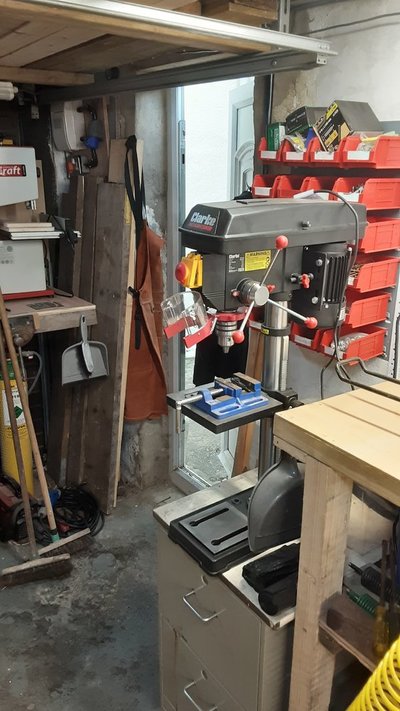
Locate an element on the screen. The height and width of the screenshot is (711, 400). concrete floor is located at coordinates (112, 668).